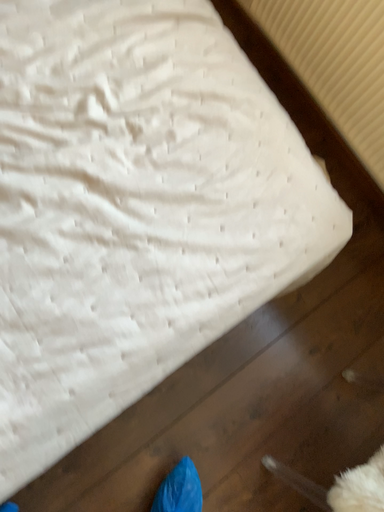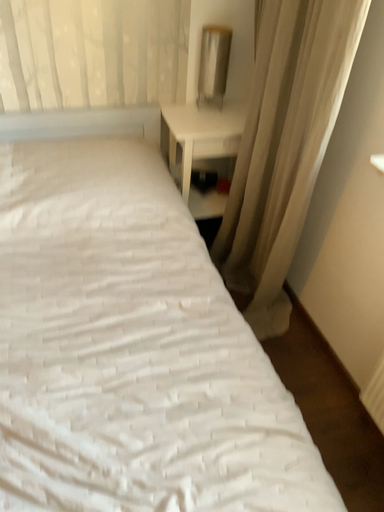
Question: How did the camera likely rotate when shooting the video?

Choices:
 (A) rotated right
 (B) rotated left

Answer: (B)